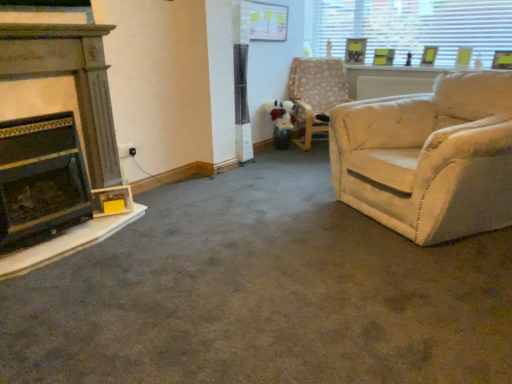
Question: Considering the relative sizes of transparent glass window at upper right and matte yellow picture frame at upper right, the 3th picture frame positioned from the left, in the image provided, is transparent glass window at upper right bigger than matte yellow picture frame at upper right, the 3th picture frame positioned from the left,?

Choices:
 (A) no
 (B) yes

Answer: (B)

Question: Can you confirm if transparent glass window at upper right is thinner than matte yellow picture frame at upper right, which appears as the first picture frame when viewed from the right?

Choices:
 (A) yes
 (B) no

Answer: (A)

Question: Is transparent glass window at upper right oriented towards matte yellow picture frame at upper right, which appears as the first picture frame when viewed from the right?

Choices:
 (A) no
 (B) yes

Answer: (B)

Question: From the image's perspective, is transparent glass window at upper right on matte yellow picture frame at upper right, which appears as the first picture frame when viewed from the right?

Choices:
 (A) yes
 (B) no

Answer: (A)

Question: Is transparent glass window at upper right positioned with its back to matte yellow picture frame at upper right, the 3th picture frame positioned from the left?

Choices:
 (A) no
 (B) yes

Answer: (B)

Question: Do you think wooden picture frame at upper right, acting as the 3th picture frame starting from the right, is within wooden fireplace at left, arranged as the second fireplace when ordered from the bottom, or outside of it?

Choices:
 (A) inside
 (B) outside

Answer: (B)

Question: Considering their positions, is wooden picture frame at upper right, arranged as the 1th picture frame when viewed from the left, located in front of or behind wooden fireplace at left, arranged as the second fireplace when ordered from the bottom?

Choices:
 (A) front
 (B) behind

Answer: (B)

Question: Looking at their shapes, would you say wooden picture frame at upper right, acting as the 3th picture frame starting from the right, is wider or thinner than wooden fireplace at left, arranged as the first fireplace when viewed from the top?

Choices:
 (A) thin
 (B) wide

Answer: (A)

Question: In terms of size, does wooden picture frame at upper right, acting as the 3th picture frame starting from the right, appear bigger or smaller than wooden fireplace at left, arranged as the first fireplace when viewed from the top?

Choices:
 (A) big
 (B) small

Answer: (B)

Question: Is wooden picture frame at upper right, the second picture frame positioned from the right, taller or shorter than wooden picture frame at upper right, acting as the 3th picture frame starting from the right?

Choices:
 (A) tall
 (B) short

Answer: (B)

Question: Is wooden picture frame at upper right, the second picture frame positioned from the right, situated inside wooden picture frame at upper right, acting as the 3th picture frame starting from the right, or outside?

Choices:
 (A) inside
 (B) outside

Answer: (B)

Question: From the image's perspective, is wooden picture frame at upper right, arranged as the 2th picture frame when viewed from the left, above or below wooden picture frame at upper right, acting as the 3th picture frame starting from the right?

Choices:
 (A) above
 (B) below

Answer: (B)

Question: Is wooden picture frame at upper right, the second picture frame positioned from the right, in front of or behind wooden picture frame at upper right, acting as the 3th picture frame starting from the right, in the image?

Choices:
 (A) behind
 (B) front

Answer: (B)

Question: In terms of size, does wooden fireplace at left, arranged as the second fireplace when ordered from the bottom, appear bigger or smaller than beige fabric chair at upper right?

Choices:
 (A) small
 (B) big

Answer: (A)

Question: Looking at their shapes, would you say wooden fireplace at left, arranged as the second fireplace when ordered from the bottom, is wider or thinner than beige fabric chair at upper right?

Choices:
 (A) wide
 (B) thin

Answer: (B)